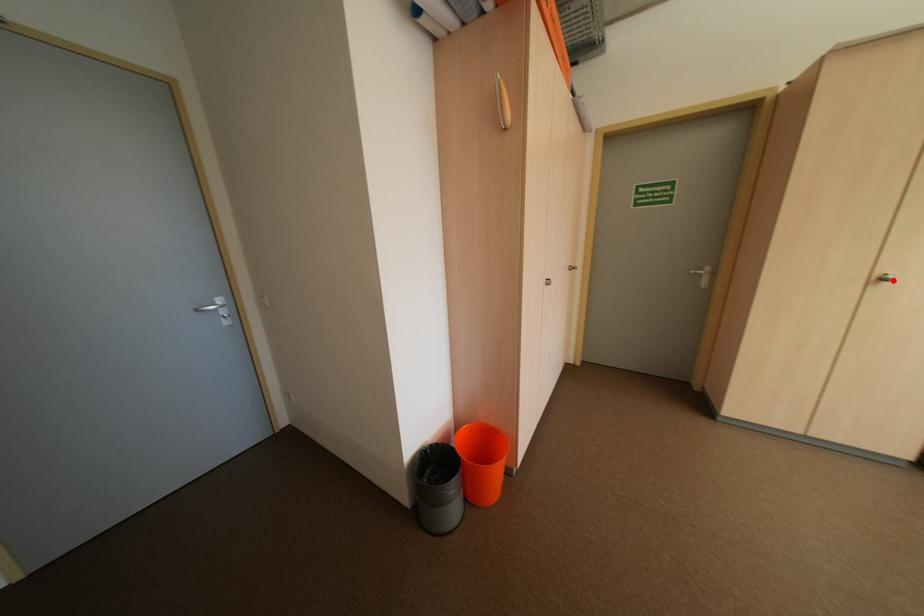
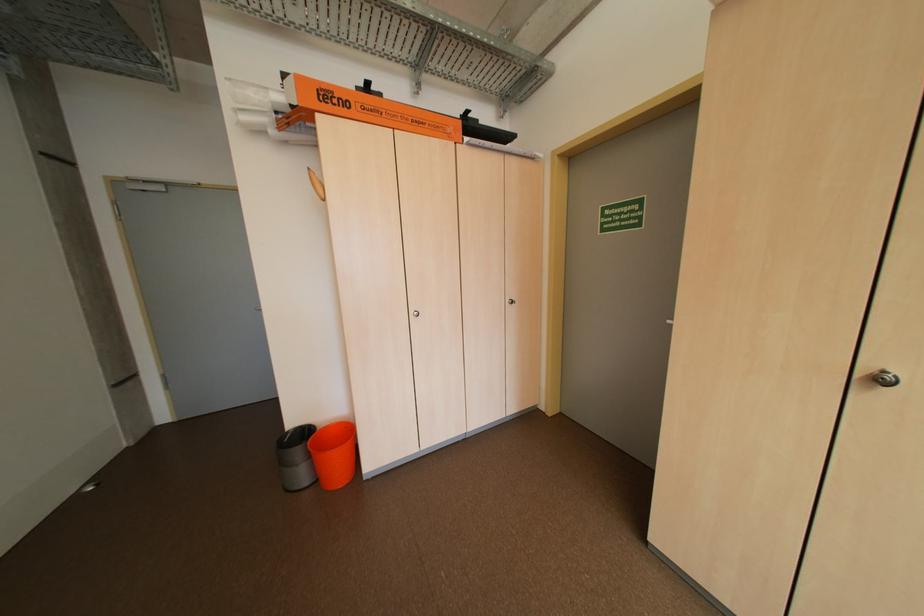
Find the pixel in the second image that matches the highlighted location in the first image.

(891, 381)